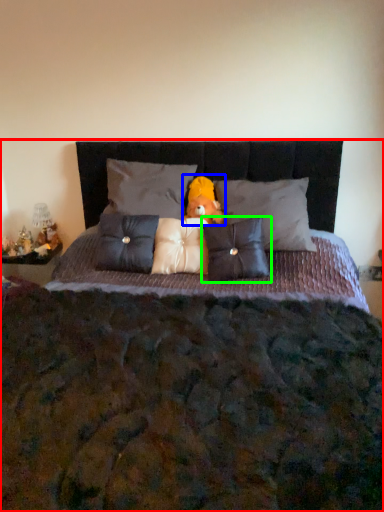
Question: Which object is positioned closest to bed (highlighted by a red box)? Select from doll (highlighted by a blue box) and pillow (highlighted by a green box).

Choices:
 (A) doll
 (B) pillow

Answer: (B)